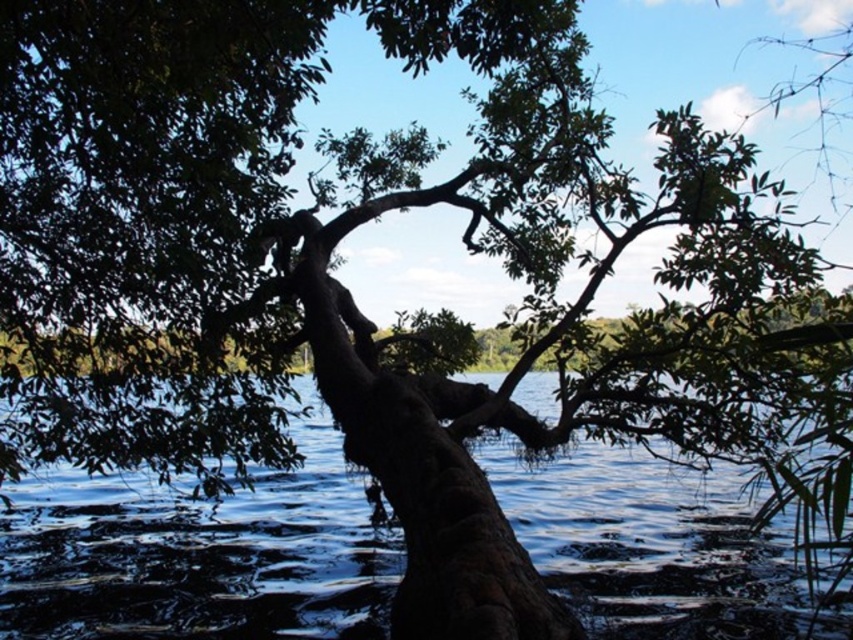
Question: Considering the relative positions of dark blue water at center and brown rough tree trunk at center in the image provided, where is dark blue water at center located with respect to brown rough tree trunk at center?

Choices:
 (A) left
 (B) right

Answer: (A)

Question: Among these objects, which one is nearest to the camera?

Choices:
 (A) brown rough tree trunk at center
 (B) dark blue water at center

Answer: (A)

Question: Does dark blue water at center have a smaller size compared to brown rough tree trunk at center?

Choices:
 (A) no
 (B) yes

Answer: (B)

Question: Among these points, which one is farthest from the camera?

Choices:
 (A) 320,285
 (B) 558,576

Answer: (B)

Question: Does dark blue water at center appear on the left side of brown rough tree trunk at center?

Choices:
 (A) no
 (B) yes

Answer: (B)

Question: Which point is closer to the camera?

Choices:
 (A) brown rough tree trunk at center
 (B) dark blue water at center

Answer: (A)